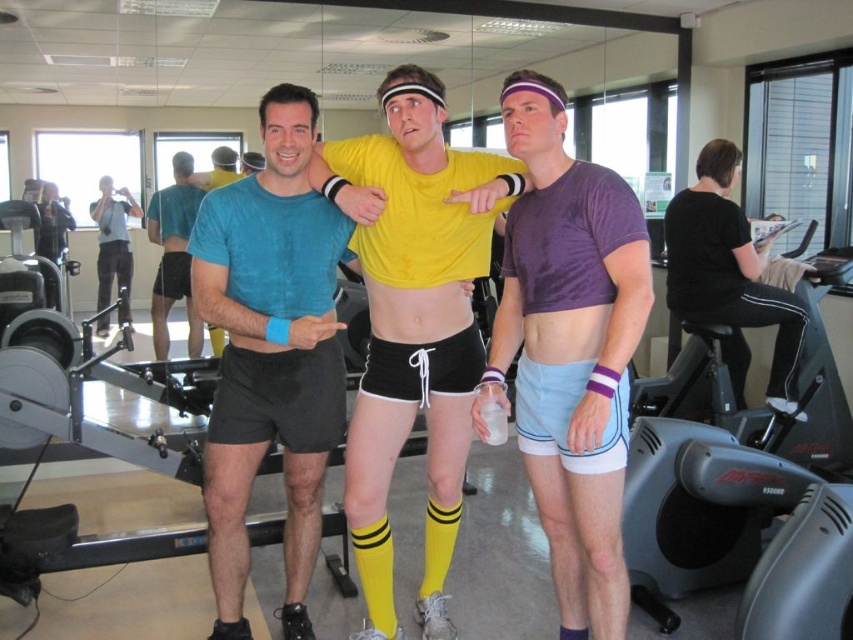
Question: Does matte blue t-shirt at center have a lesser width compared to yellow rubber socks at center?

Choices:
 (A) no
 (B) yes

Answer: (A)

Question: Does purple matte t-shirt at center come in front of black matte shorts at center?

Choices:
 (A) no
 (B) yes

Answer: (B)

Question: Which point is closer to the camera?

Choices:
 (A) matte purple shorts at center
 (B) matte blue t-shirt at center
 (C) matte black camera at left

Answer: (A)

Question: Which of the following is the farthest from the observer?

Choices:
 (A) matte purple shorts at center
 (B) yellow matte shorts at center
 (C) black matte shorts at center

Answer: (C)

Question: Among these points, which one is nearest to the camera?

Choices:
 (A) (173, 204)
 (B) (537, 100)

Answer: (B)

Question: Does matte blue shorts at center have a larger size compared to skinny white muscle at center?

Choices:
 (A) yes
 (B) no

Answer: (A)